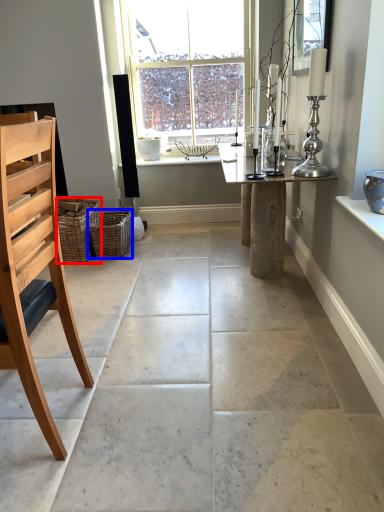
Question: Which object appears closest to the camera in this image, basket (highlighted by a red box) or basket (highlighted by a blue box)?

Choices:
 (A) basket
 (B) basket

Answer: (A)